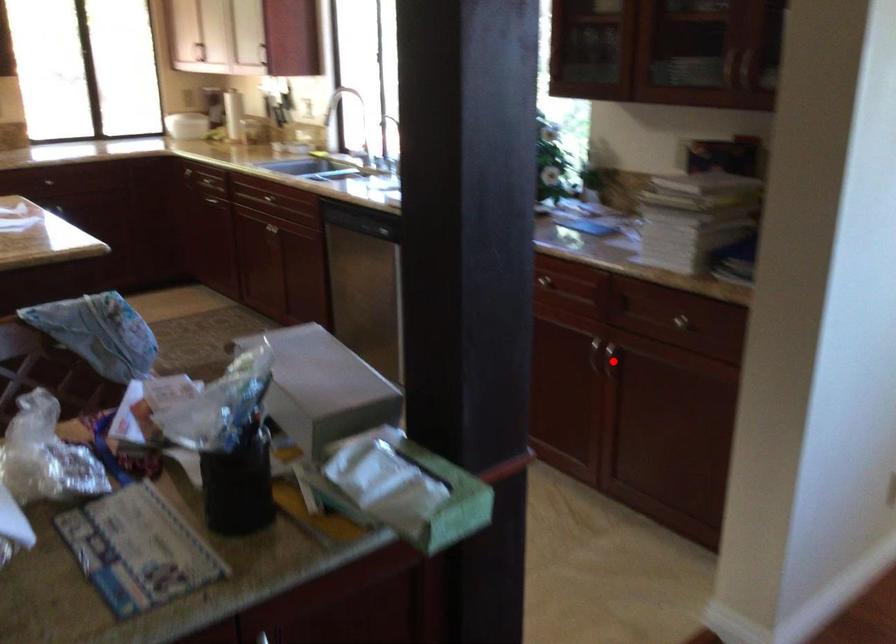
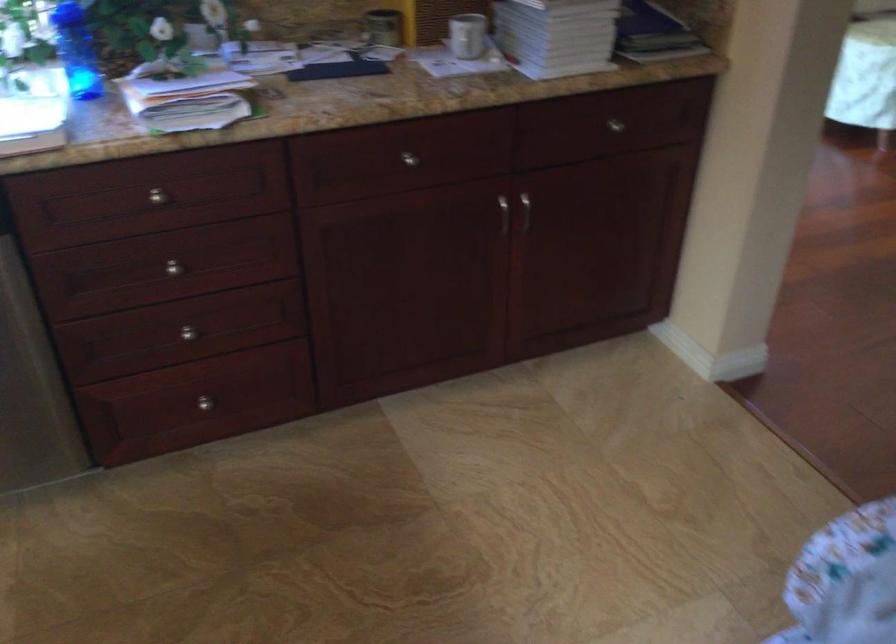
Question: I am providing you with two images of the same scene from different viewpoints. A red point is shown in image1. For the corresponding object point in image2, is it positioned nearer or farther from the camera?

Choices:
 (A) Nearer
 (B) Farther

Answer: (A)